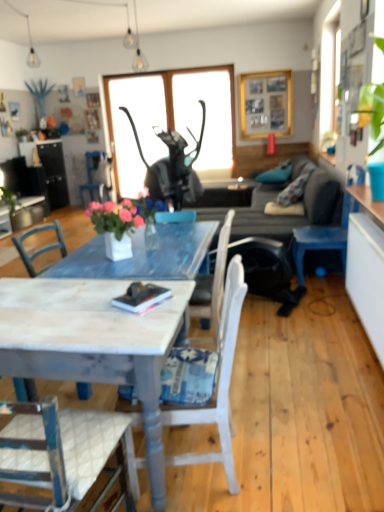
Image resolution: width=384 pixels, height=512 pixels. What are the coordinates of `empty space that is ontop of hardcover book at center (from a real-world perspective)` in the screenshot? It's located at (146, 294).